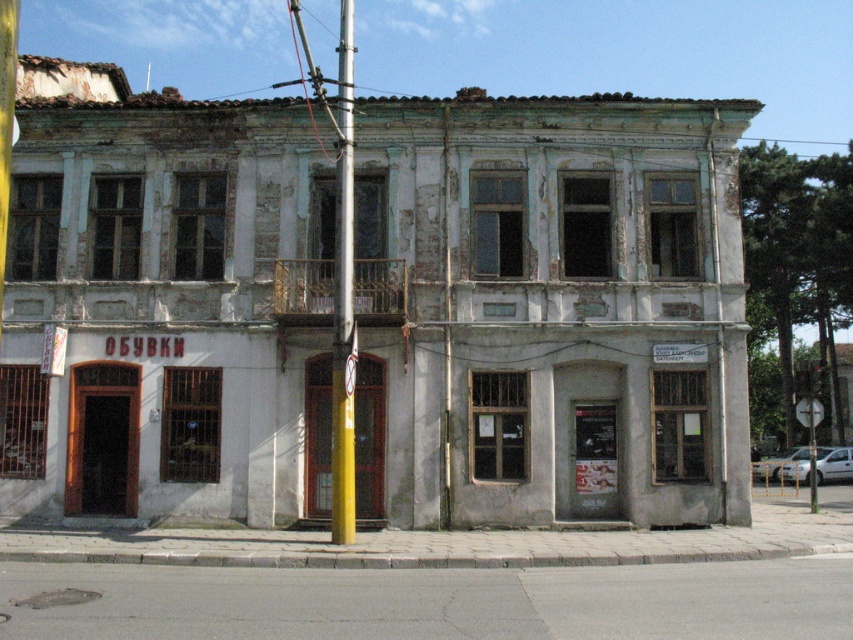
You are standing on the sidewalk in front of the old building. You see a yellow painted metal pole at center and a white plastic sign at upper right. Which object is closer to the entrance of the building?

The yellow painted metal pole at center is closer to the entrance of the building because it is to the left of the white plastic sign at upper right, which is further away.

From the picture: You are standing in front of the old building and want to take a photo. You notice two points marked on the building. The first point is at coordinate point [332,380] and the second is at point [805,410]. Which point will appear closer to the center of your camera view?

Point [332,380] is closer to the camera than point [805,410], so it will appear closer to the center of your camera view.